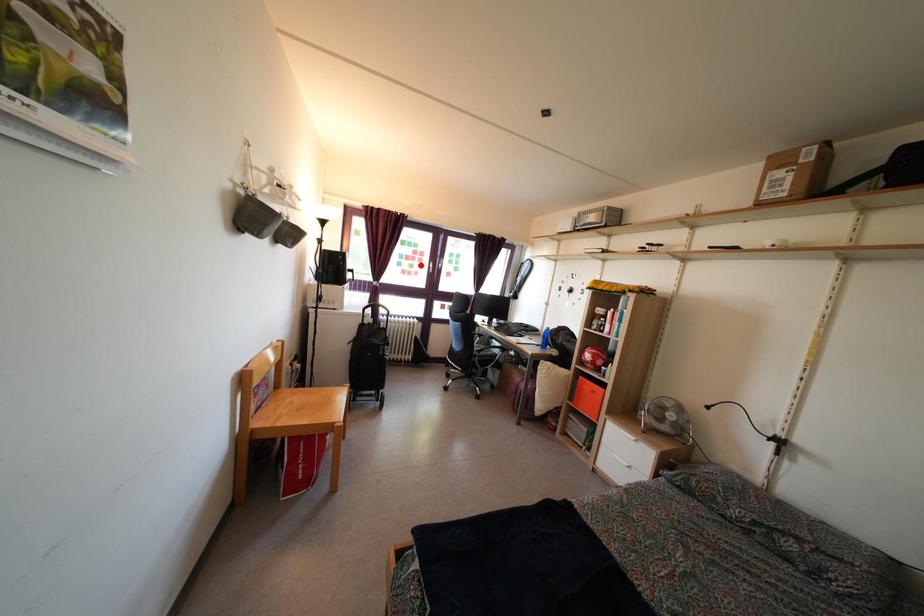
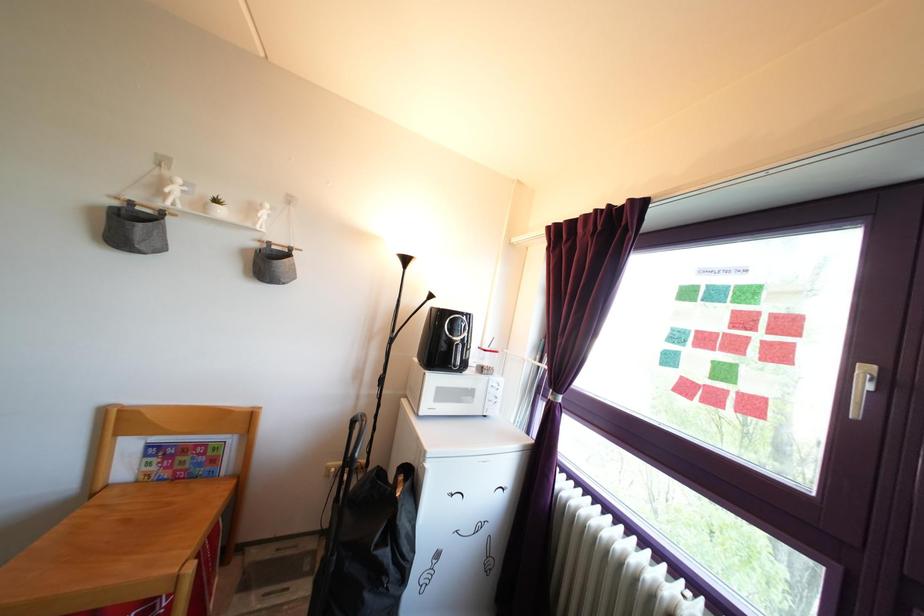
Question: I am providing you with two images of the same scene from different viewpoints. A red point is shown in image1. For the corresponding object point in image2, is it positioned nearer or farther from the camera?

Choices:
 (A) Nearer
 (B) Farther

Answer: (B)